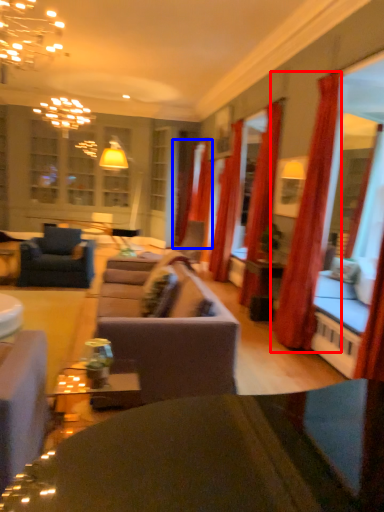
Question: Which object appears closest to the camera in this image, curtain (highlighted by a red box) or curtain (highlighted by a blue box)?

Choices:
 (A) curtain
 (B) curtain

Answer: (A)